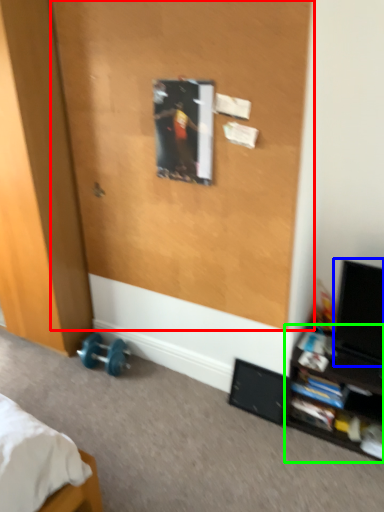
Question: Which object is the farthest from screen door (highlighted by a red box)? Choose among these: computer monitor (highlighted by a blue box) or shelf (highlighted by a green box).

Choices:
 (A) computer monitor
 (B) shelf

Answer: (B)